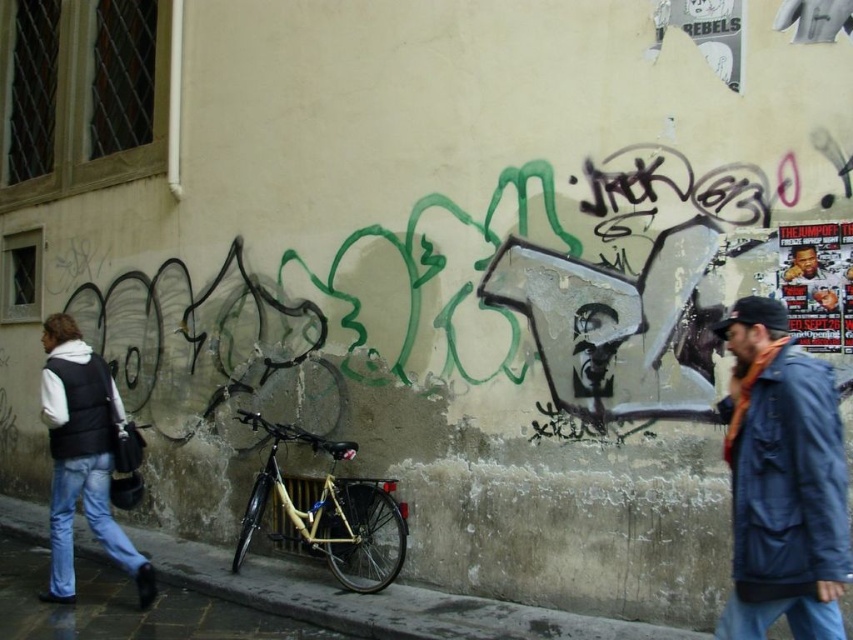
You are a delivery person who needs to place a package on the concrete sidewalk at center. However, there is a blue fabric jacket at lower right in the way. Can you move the jacket to access the sidewalk?

The blue fabric jacket at lower right is positioned over the concrete sidewalk at center, so you can move the jacket to access the sidewalk.

You are a delivery person standing in front of the weathered wall with graffiti. You need to pick up the black matte vest at left and the gold metallic bicycle at center. Which item should you reach for first to grab them in the most efficient way?

The black matte vest at left is closer to the viewer than the gold metallic bicycle at center, so you should reach for the black matte vest at left first to grab them efficiently.

You are standing in front of the graffiti wall and notice two points marked on the wall. Which of the two points, point (799, 433) or point (276, 436), is closer to your eyes?

Point (799, 433) is closer to the camera than point (276, 436), so it is closer to your eyes.